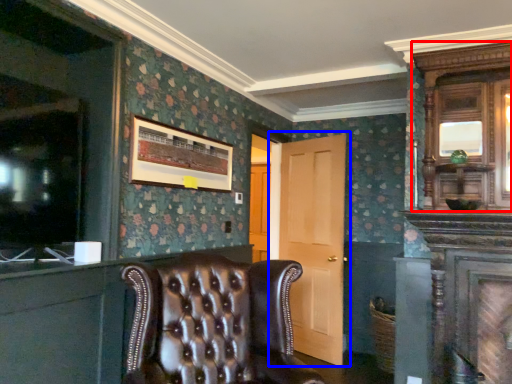
Question: Among these objects, which one is nearest to the camera, armoire (highlighted by a red box) or door (highlighted by a blue box)?

Choices:
 (A) armoire
 (B) door

Answer: (A)